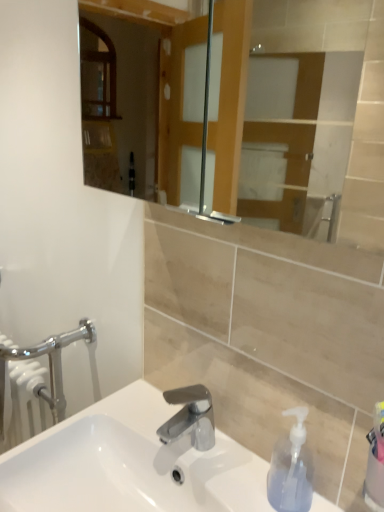
Locate an element on the screen. The width and height of the screenshot is (384, 512). vacant area that lies between transparent plastic soap dispenser at lower right and chrome metallic faucet at center is located at coordinates click(228, 480).